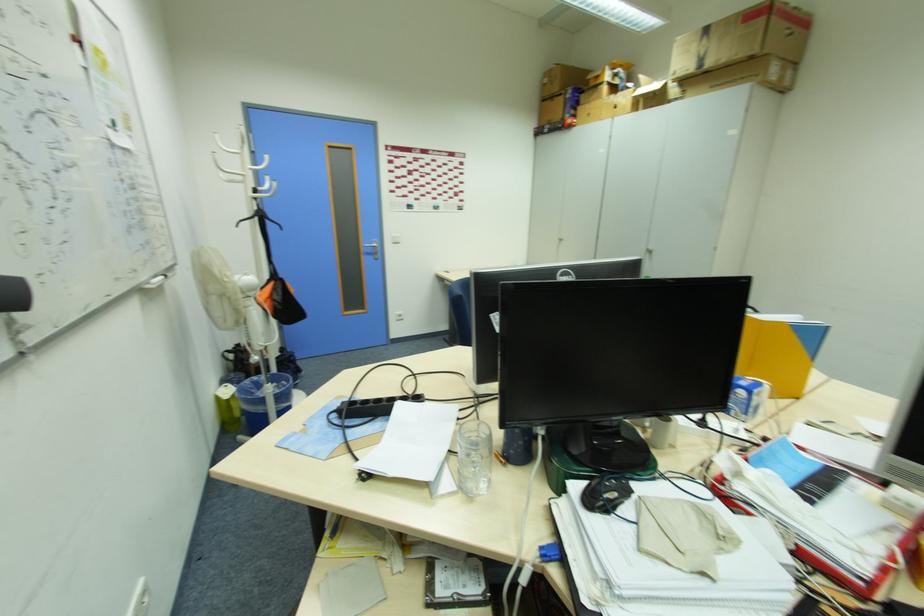
At what (x,y) coordinates should I click in order to perform the action: click on silver door handle. Please return your answer as a coordinate pair (x, y). The image size is (924, 616). Looking at the image, I should click on (371, 245).